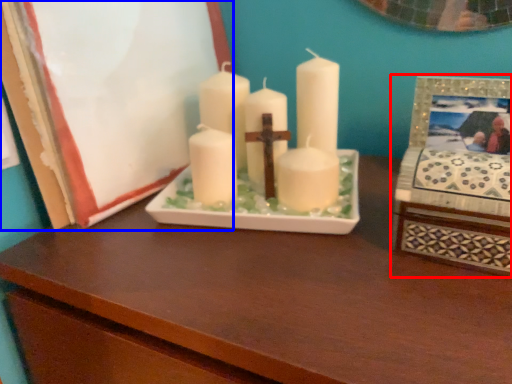
Question: Which object appears closest to the camera in this image, picture frame (highlighted by a red box) or picture frame (highlighted by a blue box)?

Choices:
 (A) picture frame
 (B) picture frame

Answer: (A)